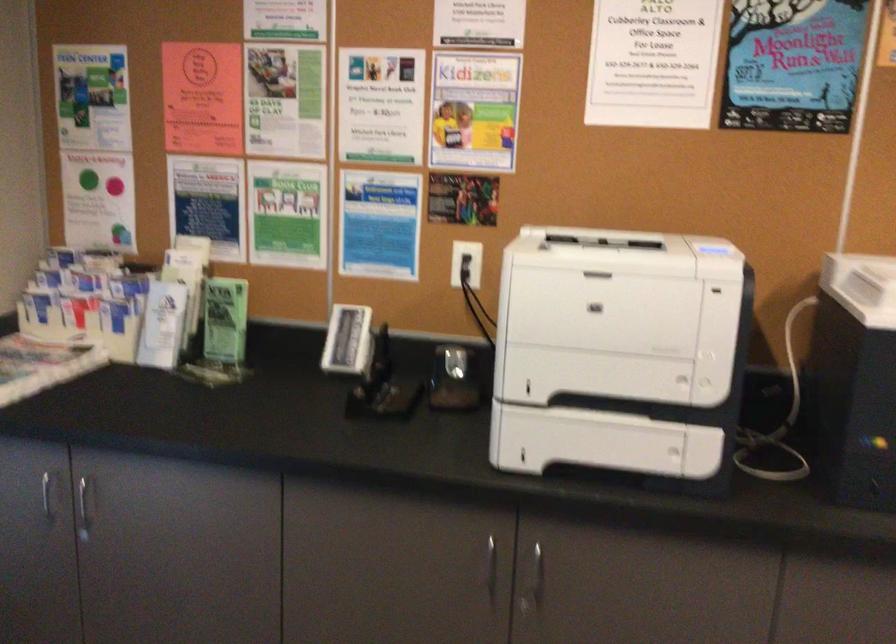
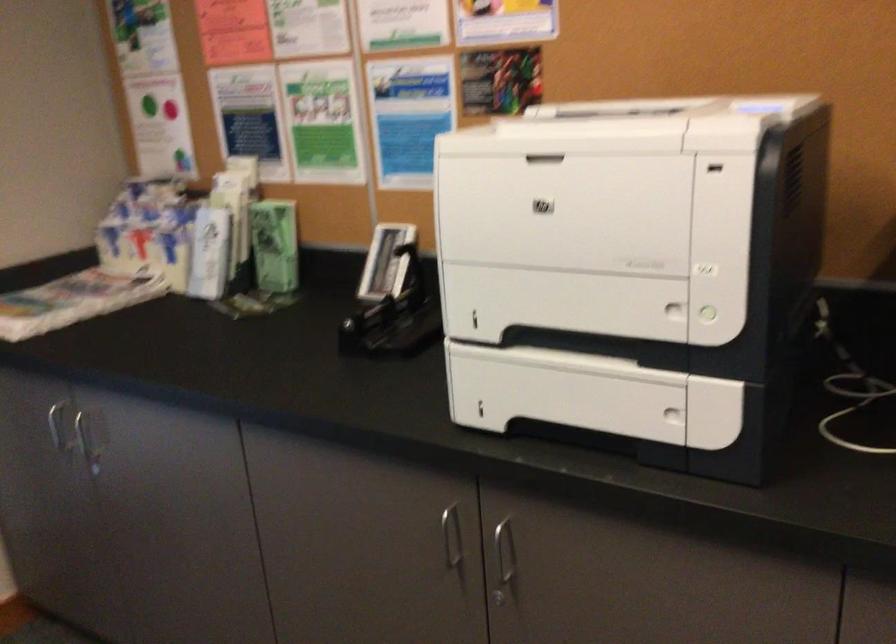
Question: The images are taken continuously from a first-person perspective. In which direction is your viewpoint rotating?

Choices:
 (A) Left
 (B) Right
 (C) Up
 (D) Down

Answer: (A)